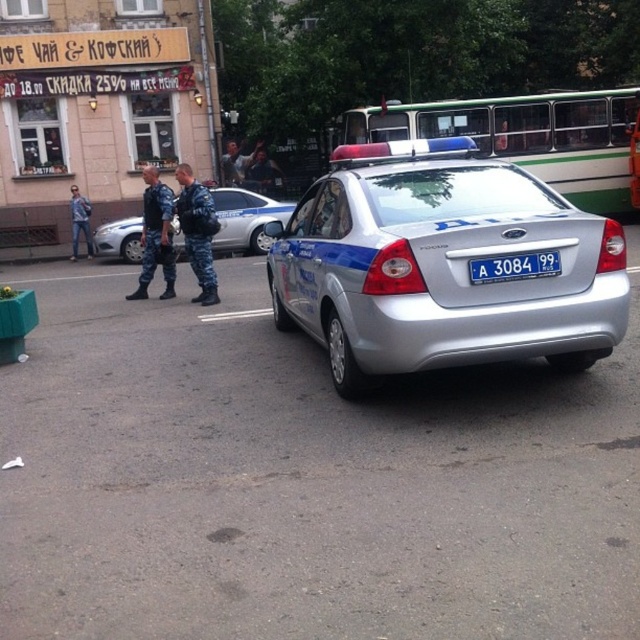
Who is higher up, white plastic license plate at center or denim jacket at left?

denim jacket at left is higher up.

Which is in front, point (490, 266) or point (86, 208)?

Point (490, 266) is in front.

You are a GUI agent. You are given a task and a screenshot of the screen. Output one action in this format:
    pyautogui.click(x=<x>, y=<y>)
    Task: Click on the white plastic license plate at center
    
    Given the screenshot: What is the action you would take?
    pos(513,266)

Is point (147, 259) closer to camera compared to point (90, 250)?

Yes, point (147, 259) is closer to viewer.

Is camouflage uniform pants at center above denim jacket at left?

Incorrect, camouflage uniform pants at center is not positioned above denim jacket at left.

Who is more distant from viewer, (172, 266) or (81, 228)?

Positioned behind is point (81, 228).

Where is `camouflage uniform pants at center`? camouflage uniform pants at center is located at coordinates (156, 236).

Is green and white bus at upper center above white plastic license plate at center?

Indeed, green and white bus at upper center is positioned over white plastic license plate at center.

Does green and white bus at upper center have a greater height compared to white plastic license plate at center?

Correct, green and white bus at upper center is much taller as white plastic license plate at center.

What are the coordinates of `green and white bus at upper center` in the screenshot? It's located at (531, 138).